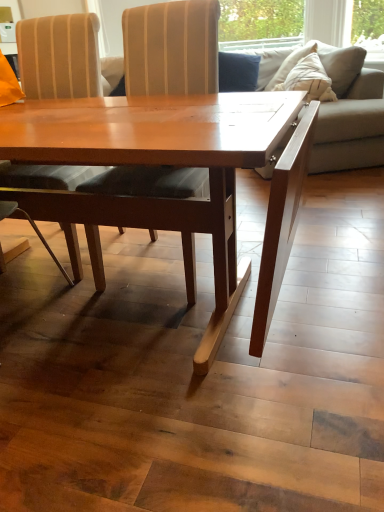
Question: Considering the relative sizes of velvet blue pillow at upper center and beige fabric couch at right in the image provided, is velvet blue pillow at upper center thinner than beige fabric couch at right?

Choices:
 (A) yes
 (B) no

Answer: (A)

Question: Would you say velvet blue pillow at upper center is outside beige fabric couch at right?

Choices:
 (A) no
 (B) yes

Answer: (A)

Question: Can you confirm if velvet blue pillow at upper center is shorter than beige fabric couch at right?

Choices:
 (A) yes
 (B) no

Answer: (A)

Question: Is velvet blue pillow at upper center further to the viewer compared to beige fabric couch at right?

Choices:
 (A) yes
 (B) no

Answer: (A)

Question: Can you see velvet blue pillow at upper center touching beige fabric couch at right?

Choices:
 (A) yes
 (B) no

Answer: (B)

Question: From the image's perspective, is wooden striped chair at center, arranged as the 1th chair when viewed from the right, above or below beige fabric couch at right?

Choices:
 (A) below
 (B) above

Answer: (A)

Question: Relative to beige fabric couch at right, is wooden striped chair at center, arranged as the 1th chair when viewed from the right, in front or behind?

Choices:
 (A) front
 (B) behind

Answer: (A)

Question: Is wooden striped chair at center, arranged as the 1th chair when viewed from the right, wider or thinner than beige fabric couch at right?

Choices:
 (A) wide
 (B) thin

Answer: (B)

Question: In the image, is wooden striped chair at center, arranged as the 1th chair when viewed from the right, on the left side or the right side of beige fabric couch at right?

Choices:
 (A) right
 (B) left

Answer: (B)

Question: From a real-world perspective, is matte wood chair at center, which ranks as the 2th chair in right-to-left order, positioned above or below velvet blue pillow at upper center?

Choices:
 (A) above
 (B) below

Answer: (B)

Question: Considering the positions of matte wood chair at center, which appears as the first chair when viewed from the left, and velvet blue pillow at upper center in the image, is matte wood chair at center, which appears as the first chair when viewed from the left, taller or shorter than velvet blue pillow at upper center?

Choices:
 (A) short
 (B) tall

Answer: (B)

Question: Would you say matte wood chair at center, which appears as the first chair when viewed from the left, is inside or outside velvet blue pillow at upper center?

Choices:
 (A) outside
 (B) inside

Answer: (A)

Question: Is matte wood chair at center, which appears as the first chair when viewed from the left, bigger or smaller than velvet blue pillow at upper center?

Choices:
 (A) big
 (B) small

Answer: (A)

Question: Considering the positions of point (225, 89) and point (119, 200), is point (225, 89) closer or farther from the camera than point (119, 200)?

Choices:
 (A) closer
 (B) farther

Answer: (B)

Question: Is velvet blue pillow at upper center inside or outside of wooden striped chair at center, arranged as the 1th chair when viewed from the right?

Choices:
 (A) outside
 (B) inside

Answer: (A)